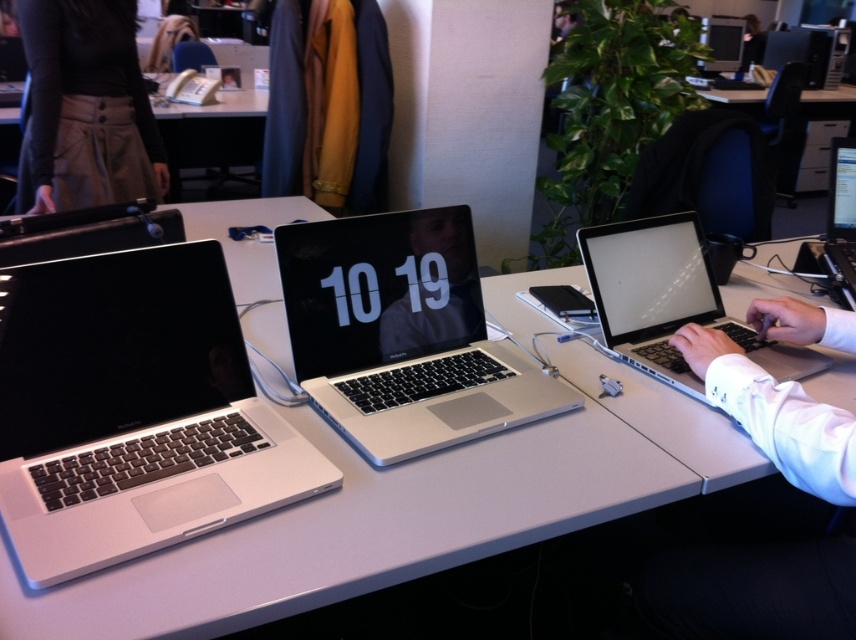
Question: Is satin silver laptop at right below silver metallic laptop at right?

Choices:
 (A) yes
 (B) no

Answer: (A)

Question: Estimate the real-world distances between objects in this image. Which object is closer to the satin silver laptop at right?

Choices:
 (A) silver metallic laptop at left
 (B) khaki cotton skirt at upper left

Answer: (A)

Question: Among these objects, which one is farthest from the camera?

Choices:
 (A) matte black monitor at upper right
 (B) satin silver laptop at right
 (C) silver metallic table at center

Answer: (A)

Question: Does sleek silver laptop at center have a greater width compared to khaki cotton skirt at upper left?

Choices:
 (A) no
 (B) yes

Answer: (A)

Question: Which object appears farthest from the camera in this image?

Choices:
 (A) silver metallic laptop at left
 (B) khaki cotton skirt at upper left
 (C) matte black monitor at upper right
 (D) satin silver laptop at right

Answer: (C)

Question: Can you confirm if silver metallic laptop at left is smaller than sleek silver laptop at center?

Choices:
 (A) no
 (B) yes

Answer: (B)